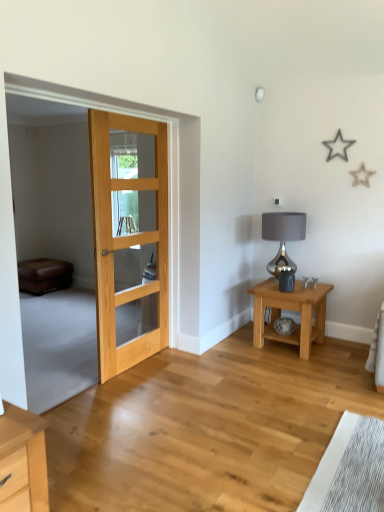
Question: Looking at their shapes, would you say light brown wood nightstand at lower right is wider or thinner than shiny metallic lamp at right?

Choices:
 (A) thin
 (B) wide

Answer: (B)

Question: From the image's perspective, is light brown wood nightstand at lower right above or below shiny metallic lamp at right?

Choices:
 (A) below
 (B) above

Answer: (A)

Question: Estimate the real-world distances between objects in this image. Which object is closer to the light brown wood nightstand at lower right?

Choices:
 (A) shiny metallic lamp at right
 (B) brown leather couch at left
 (C) natural wood door at left

Answer: (A)

Question: Which of these objects is positioned closest to the brown leather couch at left?

Choices:
 (A) shiny metallic lamp at right
 (B) light brown wood nightstand at lower right
 (C) natural wood door at left

Answer: (C)